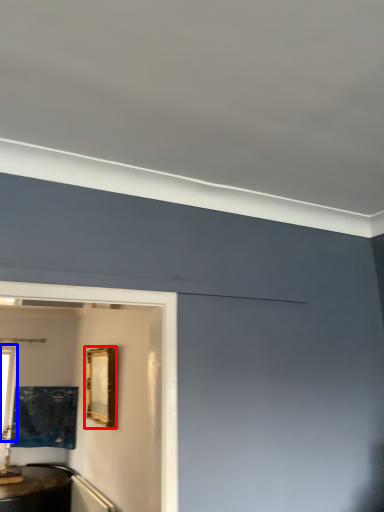
Question: Which object is further to the camera taking this photo, picture frame (highlighted by a red box) or window (highlighted by a blue box)?

Choices:
 (A) picture frame
 (B) window

Answer: (B)